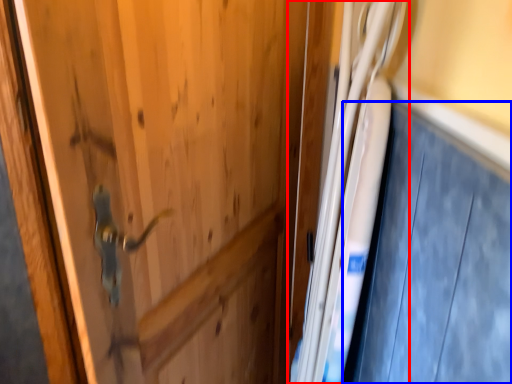
Question: Which object is closer to the camera taking this photo, fridge (highlighted by a red box) or car door (highlighted by a blue box)?

Choices:
 (A) fridge
 (B) car door

Answer: (B)